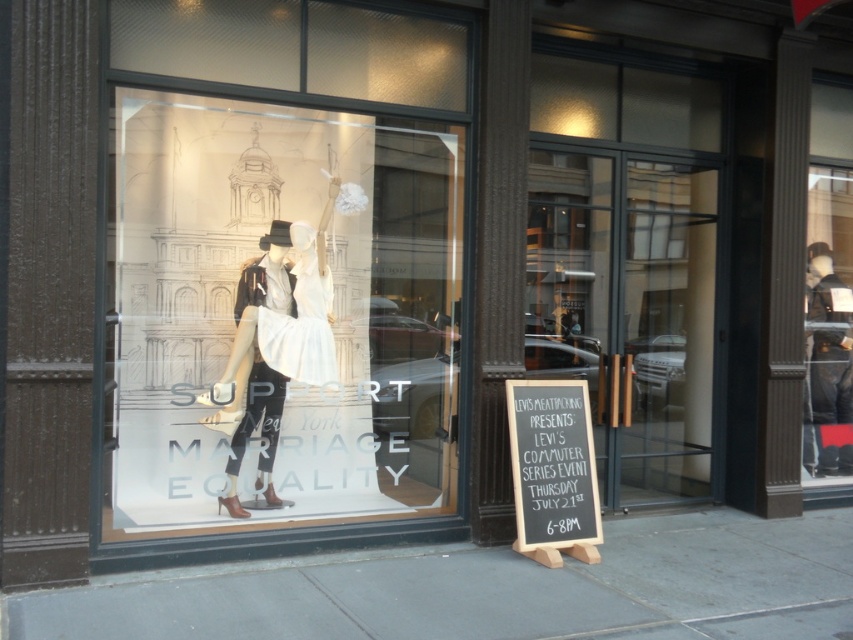
Is matte glass mannequins at center wider than white satin dress at center?

Yes, matte glass mannequins at center is wider than white satin dress at center.

Who is higher up, matte glass mannequins at center or white satin dress at center?

white satin dress at center is above.

The height and width of the screenshot is (640, 853). Describe the element at coordinates (279, 316) in the screenshot. I see `matte glass mannequins at center` at that location.

I want to click on matte glass mannequins at center, so click(279, 316).

This screenshot has height=640, width=853. Describe the element at coordinates (276, 342) in the screenshot. I see `white matte dress at center` at that location.

Is point (317, 269) farther from camera compared to point (521, 508)?

That is True.

Which is in front, point (288, 291) or point (579, 387)?

Point (579, 387) is in front.

Image resolution: width=853 pixels, height=640 pixels. In order to click on white matte dress at center in this screenshot , I will do `click(276, 342)`.

Who is taller, black chalkboard at lower right or white satin dress at center?

Standing taller between the two is black chalkboard at lower right.

Is point (555, 541) farther from viewer compared to point (309, 280)?

No, (555, 541) is in front of (309, 280).

At what (x,y) coordinates should I click in order to perform the action: click on black chalkboard at lower right. Please return your answer as a coordinate pair (x, y). Image resolution: width=853 pixels, height=640 pixels. Looking at the image, I should click on (553, 470).

Find the location of a particular element. black chalkboard at lower right is located at coordinates (553, 470).